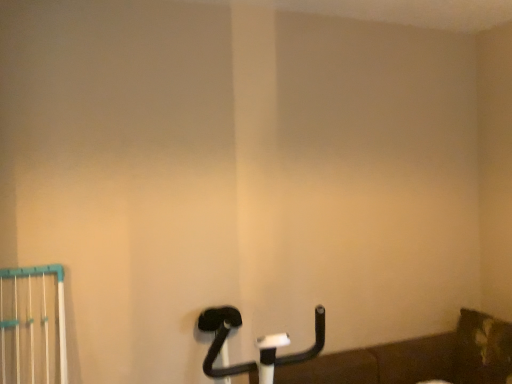
The height and width of the screenshot is (384, 512). Identify the location of brown fabric pillow at lower right. (482, 349).

The height and width of the screenshot is (384, 512). What do you see at coordinates (482, 349) in the screenshot?
I see `brown fabric pillow at lower right` at bounding box center [482, 349].

Find the location of a particular element. The height and width of the screenshot is (384, 512). brown fabric pillow at lower right is located at coordinates (482, 349).